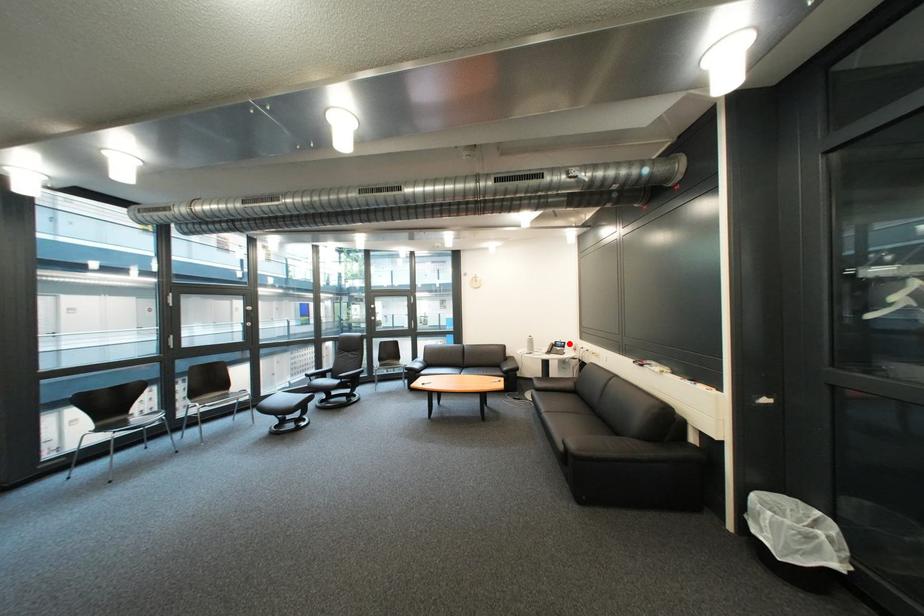
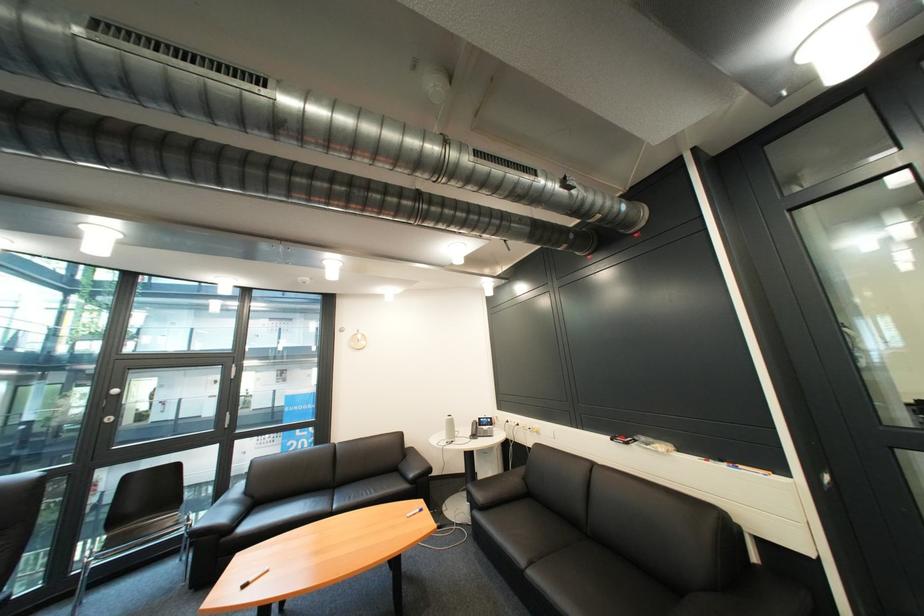
Find the pixel in the second image that matches the highlighted location in the first image.

(492, 419)